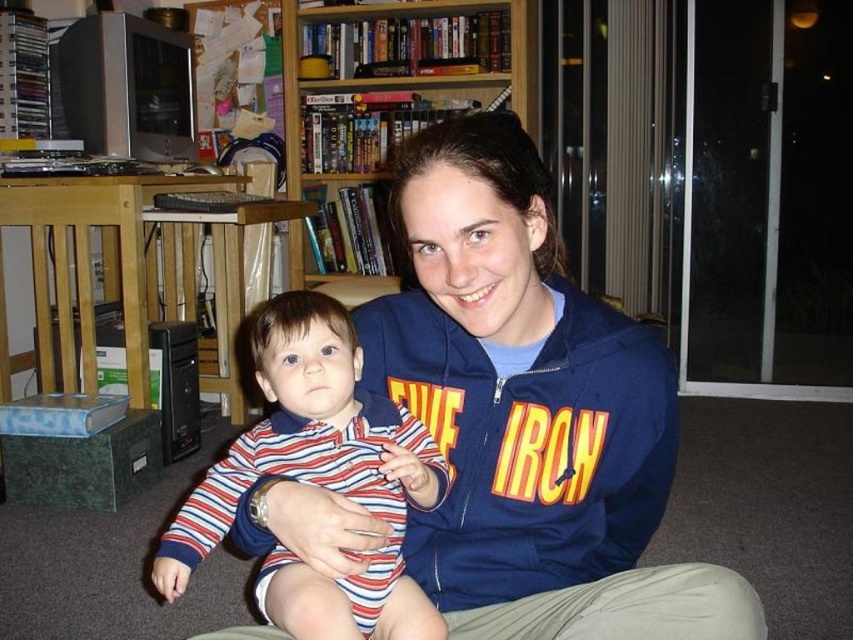
Who is more distant from viewer, [604,435] or [405,451]?

The point [604,435] is behind.

From the picture: Is the position of navy blue hoodie at center less distant than that of striped cotton onesie at center?

Yes, navy blue hoodie at center is closer to the viewer.

Who is more forward, (479, 321) or (296, 438)?

Point (479, 321)

The width and height of the screenshot is (853, 640). Identify the location of navy blue hoodie at center. coord(531,413).

Does navy blue hoodie at center appear under wooden bookshelf at upper center?

Indeed, navy blue hoodie at center is positioned under wooden bookshelf at upper center.

Is point (614, 596) positioned after point (537, 100)?

No.

Locate an element on the screen. The height and width of the screenshot is (640, 853). navy blue hoodie at center is located at coordinates (531, 413).

Which is more to the left, striped cotton onesie at center or wooden bookshelf at upper center?

From the viewer's perspective, wooden bookshelf at upper center appears more on the left side.

Looking at this image, is striped cotton onesie at center shorter than wooden bookshelf at upper center?

Indeed, striped cotton onesie at center has a lesser height compared to wooden bookshelf at upper center.

Between point (341, 417) and point (358, 84), which one is positioned in front?

Point (341, 417) is more forward.

Find the location of a particular element. Image resolution: width=853 pixels, height=640 pixels. striped cotton onesie at center is located at coordinates (315, 480).